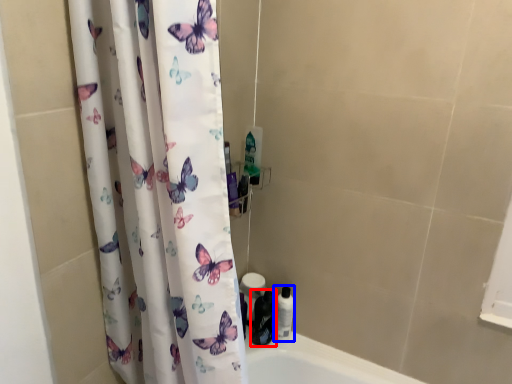
Question: Which point is closer to the camera, toiletry (highlighted by a red box) or toiletry (highlighted by a blue box)?

Choices:
 (A) toiletry
 (B) toiletry

Answer: (A)